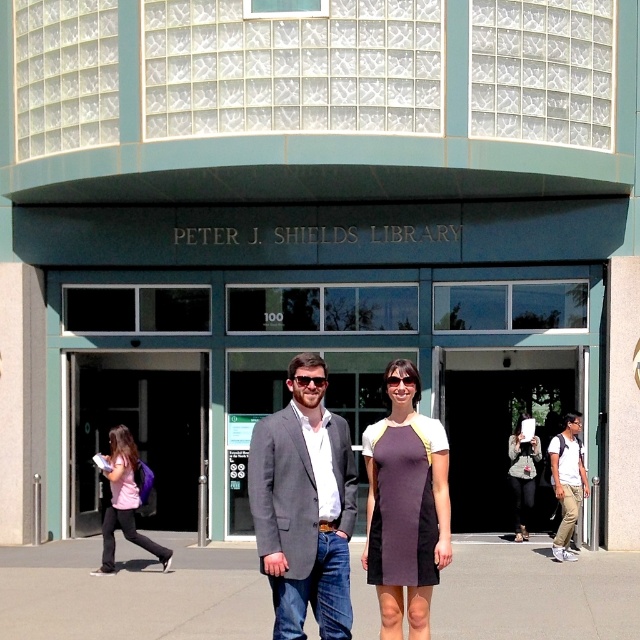
Question: Does dark purple jersey dress at center appear on the right side of pink fabric shirt at lower left?

Choices:
 (A) no
 (B) yes

Answer: (B)

Question: From the image, what is the correct spatial relationship of gray wool blazer at center in relation to solid purple dress at center?

Choices:
 (A) below
 (B) above

Answer: (B)

Question: Which point is closer to the camera taking this photo?

Choices:
 (A) (109, 480)
 (B) (296, 385)

Answer: (B)

Question: Which of the following is the closest to the observer?

Choices:
 (A) coord(396,449)
 (B) coord(48,630)
 (C) coord(410,513)
 (D) coord(531,484)

Answer: (C)

Question: Among these objects, which one is nearest to the camera?

Choices:
 (A) gray concrete pavement at center
 (B) dark purple jersey dress at center
 (C) light brown leather backpack at right

Answer: (B)

Question: Can you confirm if gray concrete pavement at center is positioned to the left of pink fabric shirt at lower left?

Choices:
 (A) yes
 (B) no

Answer: (B)